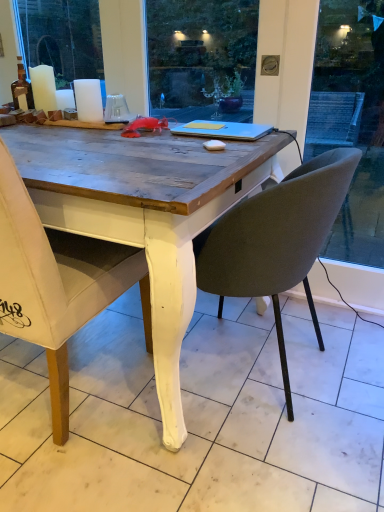
Where is `vacant area on top of white painted wood leg at lower center (from a real-world perspective)`? The image size is (384, 512). vacant area on top of white painted wood leg at lower center (from a real-world perspective) is located at coordinates (186, 377).